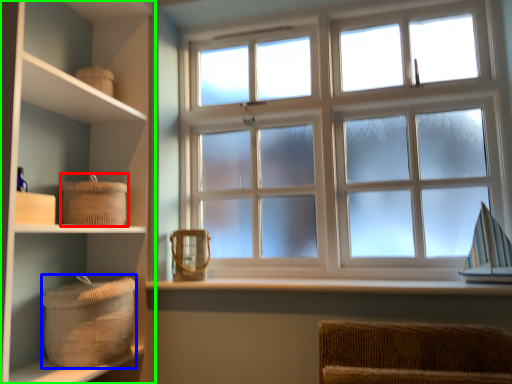
Question: Estimate the real-world distances between objects in this image. Which object is closer to basket (highlighted by a red box), basket (highlighted by a blue box) or shelf (highlighted by a green box)?

Choices:
 (A) basket
 (B) shelf

Answer: (B)